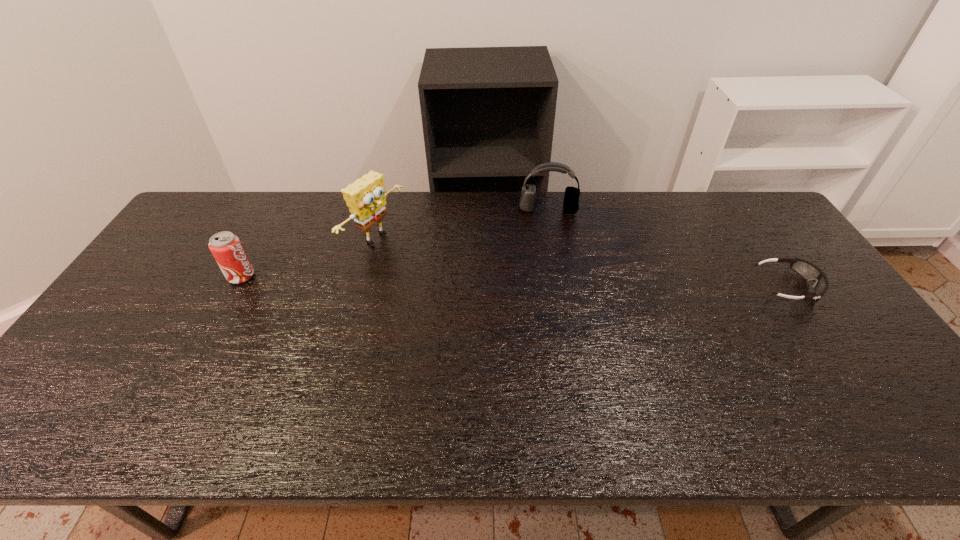
Locate an element on the screen. vacant space on the desktop that is between the leftmost object and the shortest object and is positioned on the face of the sponge is located at coordinates (466, 280).

You are a GUI agent. You are given a task and a screenshot of the screen. Output one action in this format:
    pyautogui.click(x=<x>, y=<y>)
    Task: Click on the free space on the desktop that is between the leftmost object and the shortest object and is positioned on the headband of the second object from right to left
    Image resolution: width=960 pixels, height=540 pixels.
    Given the screenshot: What is the action you would take?
    pyautogui.click(x=550, y=282)